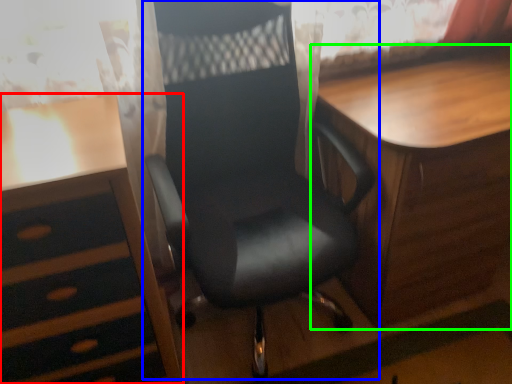
Question: Which is nearer to the desk (highlighted by a red box)? chair (highlighted by a blue box) or table (highlighted by a green box).

Choices:
 (A) chair
 (B) table

Answer: (A)